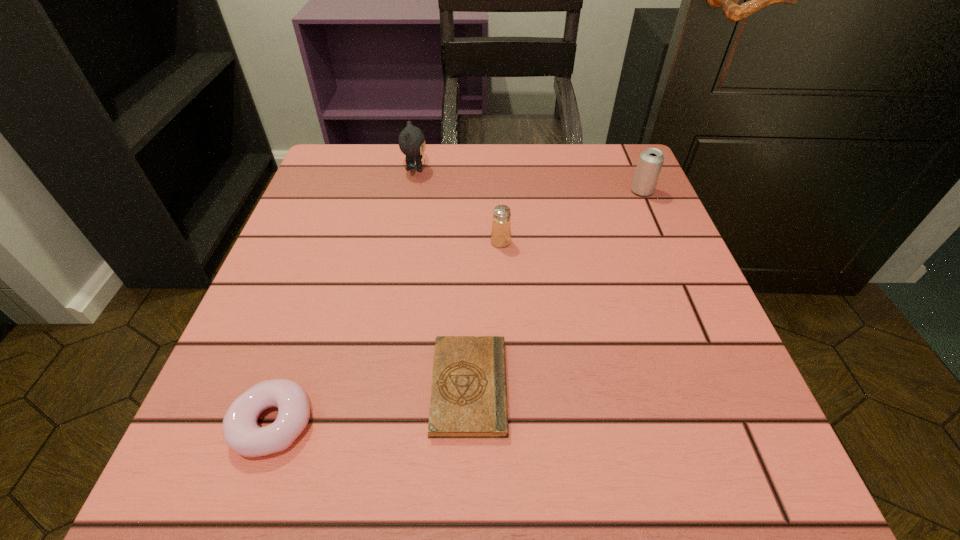
Where is `object that ranks as the closest to the doughnut`? object that ranks as the closest to the doughnut is located at coordinates (468, 399).

Identify which object is the fourth nearest to the rightmost object. Please provide its 2D coordinates. Your answer should be formatted as a tuple, i.e. [(x, y)], where the tuple contains the x and y coordinates of a point satisfying the conditions above.

[(241, 432)]

The width and height of the screenshot is (960, 540). Find the location of `free spot that satisfies the following two spatial constraints: 1. on the front-facing side of the fourth object from right to left; 2. on the front side of the doughnut`. free spot that satisfies the following two spatial constraints: 1. on the front-facing side of the fourth object from right to left; 2. on the front side of the doughnut is located at coordinates (369, 423).

This screenshot has height=540, width=960. I want to click on blank space that satisfies the following two spatial constraints: 1. on the front-facing side of the saltshaker; 2. on the right side of the kitten, so (x=402, y=242).

Image resolution: width=960 pixels, height=540 pixels. I want to click on blank space that satisfies the following two spatial constraints: 1. on the spine side of the diary; 2. on the front side of the fourth tallest object, so click(468, 423).

The image size is (960, 540). Identify the location of vacant area that satisfies the following two spatial constraints: 1. on the front side of the saltshaker; 2. on the spine side of the shortest object. pos(508,387).